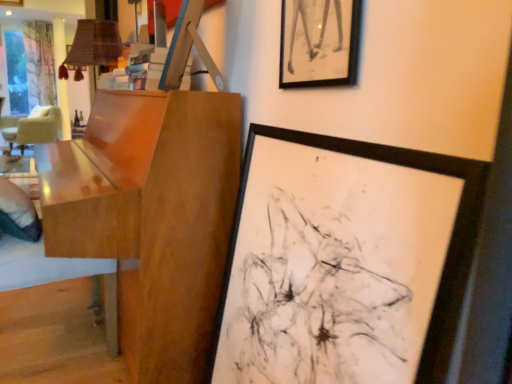
What is the approximate width of beige fabric chair at left?

The width of beige fabric chair at left is 29.26 inches.

Locate an element on the screen. The height and width of the screenshot is (384, 512). black matte picture frame at upper center, the 2th picture frame when ordered from bottom to top is located at coordinates (319, 43).

What is the approximate height of black matte picture frame at upper center, the 1th picture frame positioned from the top?

The height of black matte picture frame at upper center, the 1th picture frame positioned from the top, is 41.09 centimeters.

Locate an element on the screen. This screenshot has height=384, width=512. black matte picture frame at center, marked as the 1th picture frame in a bottom-to-top arrangement is located at coordinates (346, 261).

Locate an element on the screen. glossy wood table at left is located at coordinates (151, 215).

You are a GUI agent. You are given a task and a screenshot of the screen. Output one action in this format:
    pyautogui.click(x=<x>, y=<y>)
    Task: Click on the beige fabric chair at left
    
    Given the screenshot: What is the action you would take?
    (x=32, y=127)

Can you tell me how much glossy wood table at left and beige fabric chair at left differ in facing direction?

The angular difference between glossy wood table at left and beige fabric chair at left is 28.8 degrees.

Is point (210, 337) closer to viewer compared to point (35, 115)?

Yes, it is.

I want to click on table located on the right of beige fabric chair at left, so click(x=151, y=215).

From the image's perspective, is glossy wood table at left on beige fabric chair at left?

Actually, glossy wood table at left appears below beige fabric chair at left in the image.

Is black matte picture frame at center, the 2th picture frame viewed from the top, wider than black matte picture frame at upper center, the 1th picture frame positioned from the top?

Yes.

Between black matte picture frame at center, marked as the 1th picture frame in a bottom-to-top arrangement, and black matte picture frame at upper center, the 2th picture frame when ordered from bottom to top, which one has more height?

black matte picture frame at center, marked as the 1th picture frame in a bottom-to-top arrangement.

From a real-world perspective, which is physically above, black matte picture frame at center, marked as the 1th picture frame in a bottom-to-top arrangement, or black matte picture frame at upper center, the 1th picture frame positioned from the top?

black matte picture frame at upper center, the 1th picture frame positioned from the top, from a real-world perspective.

Considering the relative positions of black matte picture frame at center, the 2th picture frame viewed from the top, and black matte picture frame at upper center, the 1th picture frame positioned from the top, in the image provided, is black matte picture frame at center, the 2th picture frame viewed from the top, to the left or to the right of black matte picture frame at upper center, the 1th picture frame positioned from the top,?

black matte picture frame at center, the 2th picture frame viewed from the top, is positioned on black matte picture frame at upper center, the 1th picture frame positioned from the top,'s left side.

Is glossy wood table at left at the back of black matte picture frame at center, the 2th picture frame viewed from the top?

No, black matte picture frame at center, the 2th picture frame viewed from the top,'s orientation is not away from glossy wood table at left.

From the picture: Who is shorter, black matte picture frame at center, the 2th picture frame viewed from the top, or glossy wood table at left?

With less height is black matte picture frame at center, the 2th picture frame viewed from the top.

Is black matte picture frame at center, marked as the 1th picture frame in a bottom-to-top arrangement, next to glossy wood table at left?

No, black matte picture frame at center, marked as the 1th picture frame in a bottom-to-top arrangement, is not in contact with glossy wood table at left.

From the image's perspective, who appears lower, black matte picture frame at center, marked as the 1th picture frame in a bottom-to-top arrangement, or glossy wood table at left?

black matte picture frame at center, marked as the 1th picture frame in a bottom-to-top arrangement.

Is beige fabric chair at left bigger or smaller than black matte picture frame at center, marked as the 1th picture frame in a bottom-to-top arrangement?

In the image, beige fabric chair at left appears to be larger than black matte picture frame at center, marked as the 1th picture frame in a bottom-to-top arrangement.

Can you confirm if beige fabric chair at left is taller than black matte picture frame at center, marked as the 1th picture frame in a bottom-to-top arrangement?

In fact, beige fabric chair at left may be shorter than black matte picture frame at center, marked as the 1th picture frame in a bottom-to-top arrangement.

Is beige fabric chair at left turned away from black matte picture frame at center, marked as the 1th picture frame in a bottom-to-top arrangement?

No, beige fabric chair at left's orientation is not away from black matte picture frame at center, marked as the 1th picture frame in a bottom-to-top arrangement.

Are beige fabric chair at left and black matte picture frame at center, the 2th picture frame viewed from the top, located far from each other?

Yes, beige fabric chair at left and black matte picture frame at center, the 2th picture frame viewed from the top, are located far from each other.

In terms of width, does glossy wood table at left look wider or thinner when compared to black matte picture frame at upper center, the 2th picture frame when ordered from bottom to top?

Considering their sizes, glossy wood table at left looks broader than black matte picture frame at upper center, the 2th picture frame when ordered from bottom to top.

From the image's perspective, is glossy wood table at left under black matte picture frame at upper center, the 2th picture frame when ordered from bottom to top?

Correct, glossy wood table at left appears lower than black matte picture frame at upper center, the 2th picture frame when ordered from bottom to top, in the image.

Is glossy wood table at left taller than black matte picture frame at upper center, the 1th picture frame positioned from the top?

Indeed, glossy wood table at left has a greater height compared to black matte picture frame at upper center, the 1th picture frame positioned from the top.

Are glossy wood table at left and black matte picture frame at upper center, the 2th picture frame when ordered from bottom to top, located far from each other?

Actually, glossy wood table at left and black matte picture frame at upper center, the 2th picture frame when ordered from bottom to top, are a little close together.

From the image's perspective, which picture frame is the 1st one below the beige fabric chair at left? Please provide its 2D coordinates.

[(319, 43)]

Based on the photo, from the image's perspective, is beige fabric chair at left located beneath black matte picture frame at upper center, the 2th picture frame when ordered from bottom to top?

No.

Considering the positions of objects beige fabric chair at left and black matte picture frame at upper center, the 1th picture frame positioned from the top, in the image provided, who is more to the left, beige fabric chair at left or black matte picture frame at upper center, the 1th picture frame positioned from the top,?

From the viewer's perspective, beige fabric chair at left appears more on the left side.

Can you confirm if beige fabric chair at left is thinner than black matte picture frame at upper center, the 1th picture frame positioned from the top?

No.

Is glossy wood table at left situated inside black matte picture frame at center, the 2th picture frame viewed from the top, or outside?

glossy wood table at left is not enclosed by black matte picture frame at center, the 2th picture frame viewed from the top.

Between glossy wood table at left and black matte picture frame at center, the 2th picture frame viewed from the top, which one appears on the left side from the viewer's perspective?

glossy wood table at left is more to the left.

Does point (170, 256) come in front of point (350, 276)?

No, it is not.

Find the location of a particular element. The image size is (512, 384). picture frame that is the 2nd one when counting forward from the glossy wood table at left is located at coordinates (346, 261).

Where is `table on the right of the beige fabric chair at left`? The width and height of the screenshot is (512, 384). table on the right of the beige fabric chair at left is located at coordinates (151, 215).

You are a GUI agent. You are given a task and a screenshot of the screen. Output one action in this format:
    pyautogui.click(x=<x>, y=<y>)
    Task: Click on the picture frame below the black matte picture frame at upper center, the 2th picture frame when ordered from bottom to top (from the image's perspective)
    The height and width of the screenshot is (384, 512).
    Given the screenshot: What is the action you would take?
    pyautogui.click(x=346, y=261)

Consider the image. From the image, which object appears to be farther from black matte picture frame at center, the 2th picture frame viewed from the top, beige fabric chair at left or black matte picture frame at upper center, the 1th picture frame positioned from the top?

Among the two, beige fabric chair at left is located further to black matte picture frame at center, the 2th picture frame viewed from the top.

When comparing their distances from glossy wood table at left, does beige fabric chair at left or black matte picture frame at center, the 2th picture frame viewed from the top, seem closer?

black matte picture frame at center, the 2th picture frame viewed from the top, is positioned closer to the anchor glossy wood table at left.

Considering their positions, is black matte picture frame at upper center, the 2th picture frame when ordered from bottom to top, positioned closer to glossy wood table at left than black matte picture frame at center, the 2th picture frame viewed from the top?

black matte picture frame at center, the 2th picture frame viewed from the top.

Based on their spatial positions, is beige fabric chair at left or black matte picture frame at upper center, the 1th picture frame positioned from the top, further from glossy wood table at left?

beige fabric chair at left is further to glossy wood table at left.

When comparing their distances from glossy wood table at left, does black matte picture frame at center, marked as the 1th picture frame in a bottom-to-top arrangement, or black matte picture frame at upper center, the 2th picture frame when ordered from bottom to top, seem further?

Among the two, black matte picture frame at upper center, the 2th picture frame when ordered from bottom to top, is located further to glossy wood table at left.

Considering their positions, is black matte picture frame at center, the 2th picture frame viewed from the top, positioned further to black matte picture frame at upper center, the 2th picture frame when ordered from bottom to top, than glossy wood table at left?

The object further to black matte picture frame at upper center, the 2th picture frame when ordered from bottom to top, is glossy wood table at left.

Looking at the image, which one is located closer to glossy wood table at left, black matte picture frame at center, the 2th picture frame viewed from the top, or beige fabric chair at left?

black matte picture frame at center, the 2th picture frame viewed from the top.

Looking at the image, which one is located closer to beige fabric chair at left, black matte picture frame at upper center, the 1th picture frame positioned from the top, or black matte picture frame at center, the 2th picture frame viewed from the top?

Based on the image, black matte picture frame at center, the 2th picture frame viewed from the top, appears to be nearer to beige fabric chair at left.

Identify the location of table between black matte picture frame at center, the 2th picture frame viewed from the top, and beige fabric chair at left in the front-back direction. (151, 215).

What are the coordinates of `table between black matte picture frame at upper center, the 1th picture frame positioned from the top, and beige fabric chair at left, along the z-axis` in the screenshot? It's located at (151, 215).

Identify the location of picture frame situated between glossy wood table at left and black matte picture frame at upper center, the 1th picture frame positioned from the top, from left to right. Image resolution: width=512 pixels, height=384 pixels. (346, 261).

This screenshot has width=512, height=384. I want to click on picture frame between black matte picture frame at center, the 2th picture frame viewed from the top, and beige fabric chair at left in the front-back direction, so click(x=319, y=43).